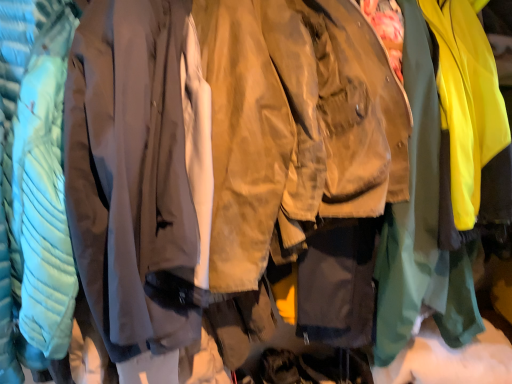
Find the location of a particular element. The height and width of the screenshot is (384, 512). matte gray sweatshirt at center, the second sweatshirt when ordered from right to left is located at coordinates (135, 169).

Describe the element at coordinates (135, 169) in the screenshot. Image resolution: width=512 pixels, height=384 pixels. I see `matte gray sweatshirt at center, acting as the 1th sweatshirt starting from the left` at that location.

How much space does matte gray sweatshirt at center, the second sweatshirt when ordered from right to left, occupy vertically?

matte gray sweatshirt at center, the second sweatshirt when ordered from right to left, is 3.48 feet in height.

Measure the distance between matte gray sweatshirt at center, the second sweatshirt when ordered from right to left, and camera.

matte gray sweatshirt at center, the second sweatshirt when ordered from right to left, is 27.70 inches away from camera.

At what (x,y) coordinates should I click in order to perform the action: click on tan suede jacket at center, the 1th sweatshirt viewed from the right. Please return your answer as a coordinate pair (x, y). Looking at the image, I should click on (296, 127).

What is the approximate width of tan suede jacket at center, the 1th sweatshirt viewed from the right?

tan suede jacket at center, the 1th sweatshirt viewed from the right, is 21.90 inches wide.

What do you see at coordinates (296, 127) in the screenshot?
I see `tan suede jacket at center, the 1th sweatshirt viewed from the right` at bounding box center [296, 127].

The image size is (512, 384). What are the coordinates of `matte gray sweatshirt at center, acting as the 1th sweatshirt starting from the left` in the screenshot? It's located at (135, 169).

Can you confirm if tan suede jacket at center, placed as the 2th sweatshirt when sorted from left to right, is positioned to the right of matte gray sweatshirt at center, the second sweatshirt when ordered from right to left?

Yes, tan suede jacket at center, placed as the 2th sweatshirt when sorted from left to right, is to the right of matte gray sweatshirt at center, the second sweatshirt when ordered from right to left.

Does tan suede jacket at center, placed as the 2th sweatshirt when sorted from left to right, lie in front of matte gray sweatshirt at center, acting as the 1th sweatshirt starting from the left?

No.

Which point is more forward, [247,3] or [93,178]?

The point [93,178] is more forward.

From the image's perspective, is tan suede jacket at center, placed as the 2th sweatshirt when sorted from left to right, located above or below matte gray sweatshirt at center, the second sweatshirt when ordered from right to left?

From the image's perspective, tan suede jacket at center, placed as the 2th sweatshirt when sorted from left to right, appears above matte gray sweatshirt at center, the second sweatshirt when ordered from right to left.

From a real-world perspective, is tan suede jacket at center, placed as the 2th sweatshirt when sorted from left to right, physically above matte gray sweatshirt at center, the second sweatshirt when ordered from right to left?

Yes, from a real-world perspective, tan suede jacket at center, placed as the 2th sweatshirt when sorted from left to right, is over matte gray sweatshirt at center, the second sweatshirt when ordered from right to left

Which of these two, tan suede jacket at center, placed as the 2th sweatshirt when sorted from left to right, or matte gray sweatshirt at center, acting as the 1th sweatshirt starting from the left, is wider?

tan suede jacket at center, placed as the 2th sweatshirt when sorted from left to right, is wider.

Is tan suede jacket at center, placed as the 2th sweatshirt when sorted from left to right, taller than matte gray sweatshirt at center, acting as the 1th sweatshirt starting from the left?

No, tan suede jacket at center, placed as the 2th sweatshirt when sorted from left to right, is not taller than matte gray sweatshirt at center, acting as the 1th sweatshirt starting from the left.

Between tan suede jacket at center, placed as the 2th sweatshirt when sorted from left to right, and matte gray sweatshirt at center, acting as the 1th sweatshirt starting from the left, which one has smaller size?

Smaller between the two is tan suede jacket at center, placed as the 2th sweatshirt when sorted from left to right.

Do you think tan suede jacket at center, the 1th sweatshirt viewed from the right, is within matte gray sweatshirt at center, acting as the 1th sweatshirt starting from the left, or outside of it?

tan suede jacket at center, the 1th sweatshirt viewed from the right, is located beyond the bounds of matte gray sweatshirt at center, acting as the 1th sweatshirt starting from the left.

Are tan suede jacket at center, placed as the 2th sweatshirt when sorted from left to right, and matte gray sweatshirt at center, the second sweatshirt when ordered from right to left, far apart?

No, tan suede jacket at center, placed as the 2th sweatshirt when sorted from left to right, is not far away from matte gray sweatshirt at center, the second sweatshirt when ordered from right to left.

Based on the photo, is tan suede jacket at center, placed as the 2th sweatshirt when sorted from left to right, facing towards matte gray sweatshirt at center, acting as the 1th sweatshirt starting from the left?

No, tan suede jacket at center, placed as the 2th sweatshirt when sorted from left to right, is not aimed at matte gray sweatshirt at center, acting as the 1th sweatshirt starting from the left.

Where is `sweatshirt directly beneath the tan suede jacket at center, the 1th sweatshirt viewed from the right (from a real-world perspective)`? The image size is (512, 384). sweatshirt directly beneath the tan suede jacket at center, the 1th sweatshirt viewed from the right (from a real-world perspective) is located at coordinates (135, 169).

Which object is positioned more to the left, matte gray sweatshirt at center, acting as the 1th sweatshirt starting from the left, or tan suede jacket at center, placed as the 2th sweatshirt when sorted from left to right?

From the viewer's perspective, matte gray sweatshirt at center, acting as the 1th sweatshirt starting from the left, appears more on the left side.

Who is more distant, matte gray sweatshirt at center, the second sweatshirt when ordered from right to left, or tan suede jacket at center, placed as the 2th sweatshirt when sorted from left to right?

tan suede jacket at center, placed as the 2th sweatshirt when sorted from left to right, is further from the camera.

Is point (149, 2) closer or farther from the camera than point (359, 40)?

Clearly, point (149, 2) is more distant from the camera than point (359, 40).

From the image's perspective, which is above, matte gray sweatshirt at center, the second sweatshirt when ordered from right to left, or tan suede jacket at center, the 1th sweatshirt viewed from the right?

tan suede jacket at center, the 1th sweatshirt viewed from the right, from the image's perspective.

From a real-world perspective, does matte gray sweatshirt at center, the second sweatshirt when ordered from right to left, sit lower than tan suede jacket at center, placed as the 2th sweatshirt when sorted from left to right?

Indeed, from a real-world perspective, matte gray sweatshirt at center, the second sweatshirt when ordered from right to left, is positioned beneath tan suede jacket at center, placed as the 2th sweatshirt when sorted from left to right.

Considering the relative sizes of matte gray sweatshirt at center, acting as the 1th sweatshirt starting from the left, and tan suede jacket at center, the 1th sweatshirt viewed from the right, in the image provided, is matte gray sweatshirt at center, acting as the 1th sweatshirt starting from the left, wider than tan suede jacket at center, the 1th sweatshirt viewed from the right,?

In fact, matte gray sweatshirt at center, acting as the 1th sweatshirt starting from the left, might be narrower than tan suede jacket at center, the 1th sweatshirt viewed from the right.

Which of these two, matte gray sweatshirt at center, the second sweatshirt when ordered from right to left, or tan suede jacket at center, the 1th sweatshirt viewed from the right, stands shorter?

With less height is tan suede jacket at center, the 1th sweatshirt viewed from the right.

In terms of size, does matte gray sweatshirt at center, acting as the 1th sweatshirt starting from the left, appear bigger or smaller than tan suede jacket at center, placed as the 2th sweatshirt when sorted from left to right?

matte gray sweatshirt at center, acting as the 1th sweatshirt starting from the left, is bigger than tan suede jacket at center, placed as the 2th sweatshirt when sorted from left to right.

Is matte gray sweatshirt at center, acting as the 1th sweatshirt starting from the left, inside or outside of tan suede jacket at center, the 1th sweatshirt viewed from the right?

matte gray sweatshirt at center, acting as the 1th sweatshirt starting from the left, lies outside tan suede jacket at center, the 1th sweatshirt viewed from the right.

Is matte gray sweatshirt at center, the second sweatshirt when ordered from right to left, with tan suede jacket at center, the 1th sweatshirt viewed from the right?

matte gray sweatshirt at center, the second sweatshirt when ordered from right to left, and tan suede jacket at center, the 1th sweatshirt viewed from the right, are not in contact.

Is matte gray sweatshirt at center, the second sweatshirt when ordered from right to left, aimed at tan suede jacket at center, the 1th sweatshirt viewed from the right?

No, matte gray sweatshirt at center, the second sweatshirt when ordered from right to left, is not facing towards tan suede jacket at center, the 1th sweatshirt viewed from the right.

How many degrees apart are the facing directions of matte gray sweatshirt at center, acting as the 1th sweatshirt starting from the left, and tan suede jacket at center, placed as the 2th sweatshirt when sorted from left to right?

They differ by 6.46e-05 degrees in their facing directions.

In the scene shown: Measure the distance between matte gray sweatshirt at center, acting as the 1th sweatshirt starting from the left, and tan suede jacket at center, the 1th sweatshirt viewed from the right.

They are 6.78 inches apart.

Identify the location of sweatshirt on the right of matte gray sweatshirt at center, acting as the 1th sweatshirt starting from the left. (296, 127).

Locate an element on the screen. This screenshot has height=384, width=512. sweatshirt that is below the tan suede jacket at center, placed as the 2th sweatshirt when sorted from left to right (from the image's perspective) is located at coordinates (135, 169).

Where is `sweatshirt behind the matte gray sweatshirt at center, the second sweatshirt when ordered from right to left`? The height and width of the screenshot is (384, 512). sweatshirt behind the matte gray sweatshirt at center, the second sweatshirt when ordered from right to left is located at coordinates (296, 127).